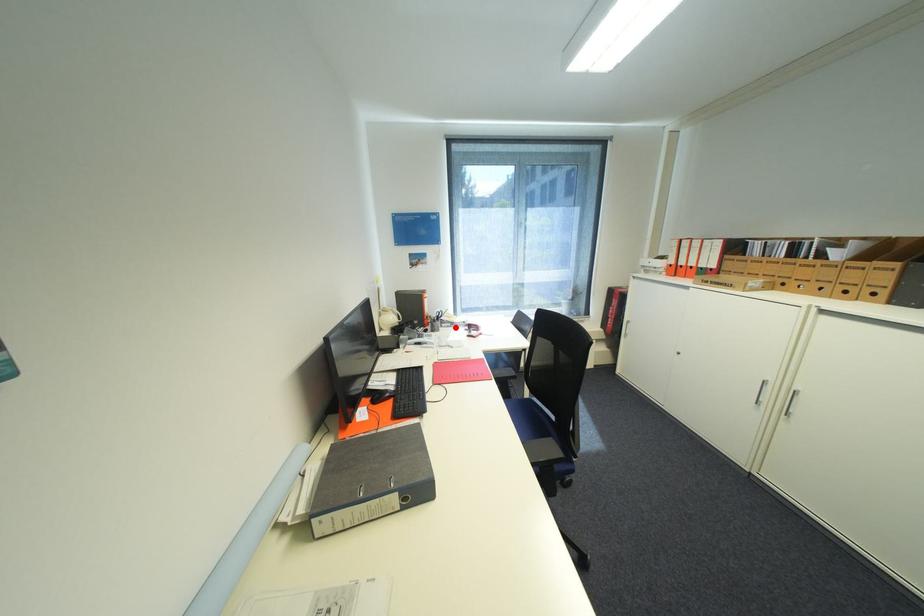
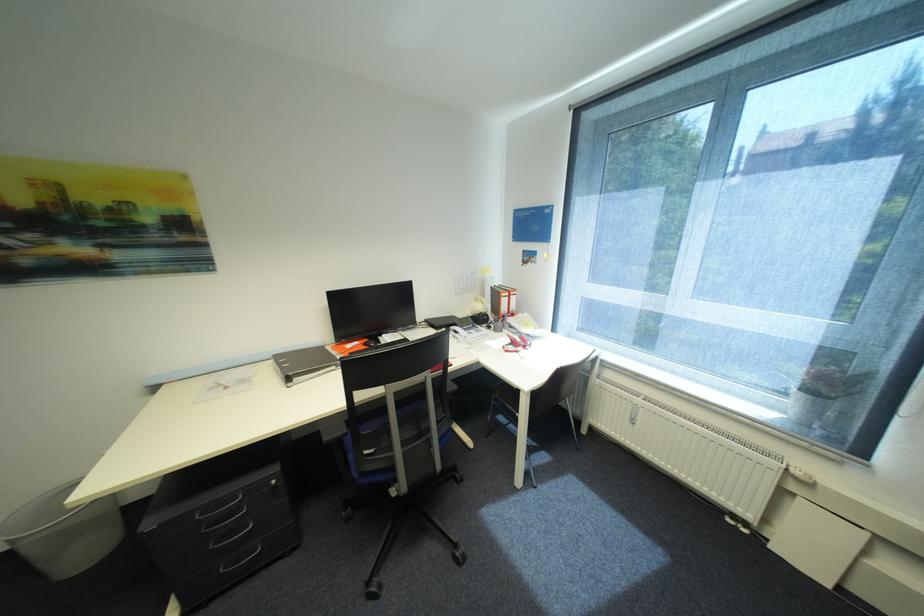
Locate, in the second image, the point that corresponds to the highlighted location in the first image.

(521, 333)